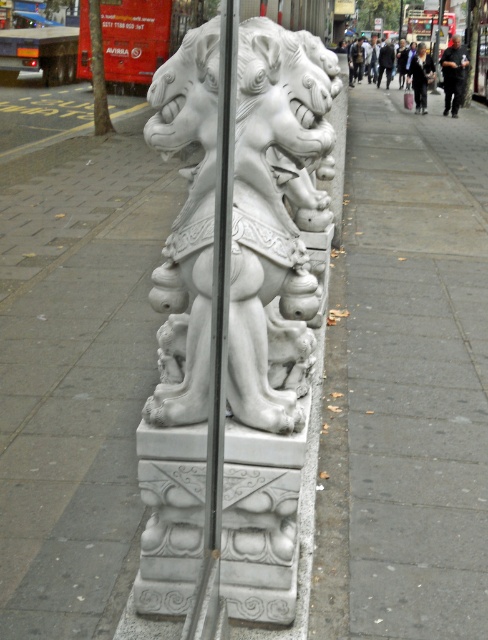
Which is more to the left, gray concrete pavement at center or white stone lion at center?

Positioned to the left is white stone lion at center.

In the scene shown: Does gray concrete pavement at center have a lesser height compared to white stone lion at center?

Incorrect, gray concrete pavement at center's height does not fall short of white stone lion at center's.

This screenshot has width=488, height=640. In order to click on gray concrete pavement at center in this screenshot , I will do `click(415, 369)`.